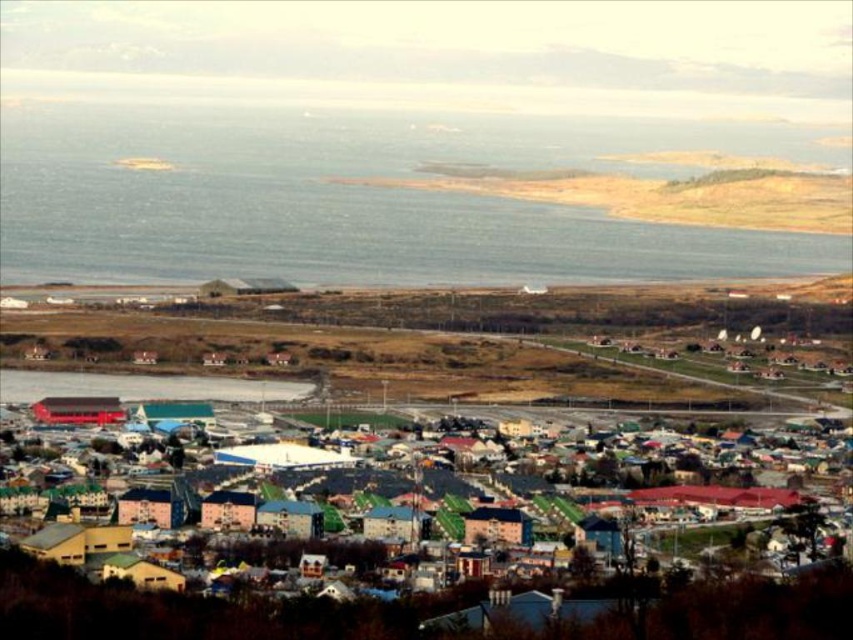
You are standing at the edge of the road in the coastal town and see the blue water at center and the multicolored wooden houses at center. Which one is positioned to the left side?

The blue water at center is to the left of the multicolored wooden houses at center.

You are standing at the edge of the road in the coastal town and notice the blue water at center and the multicolored wooden houses at center. Which of these two objects appears taller from your vantage point?

The blue water at center appears taller than the multicolored wooden houses at center from your vantage point.

You are a delivery drone with a maximum flight range of 50 meters. You need to deliver a package from the blue water at center to the multicolored wooden houses at center. Can you complete the delivery without needing a recharge?

The distance between blue water at center and multicolored wooden houses at center is 59.18 meters, which exceeds the drone s maximum flight range of 50 meters. Therefore, the drone cannot complete the delivery without recharging.